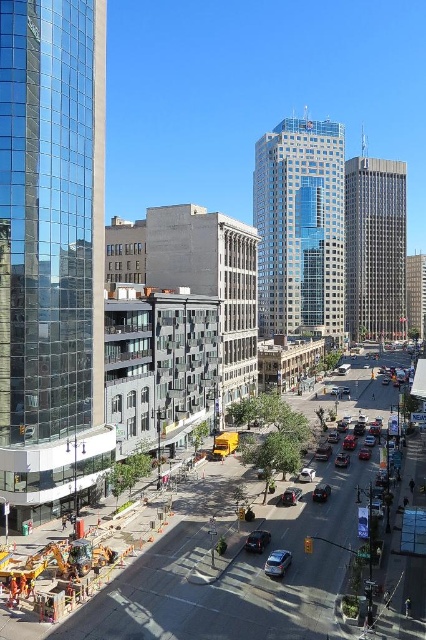
You are a delivery driver needing to park your truck which is 10 meters long. You see the concrete construction site at lower left and the shiny black sedan at center. Which location would provide enough space for your truck?

The concrete construction site at lower left is larger in size than the shiny black sedan at center, so the concrete construction site at lower left would provide enough space for your 10 meter long truck.

You are a delivery driver approaching the scene from the street level. You need to park your vehicle, which is the same size as the satin black sedan at center, in an area where it won t block the view of the tall glass building on the left. Based on their heights, can you park your vehicle near the concrete construction site at lower left?

The concrete construction site at lower left is taller than the satin black sedan at center. Since the construction site is taller, parking your vehicle near it would not block the view of the tall glass building on the left as the construction site already obscures that area.